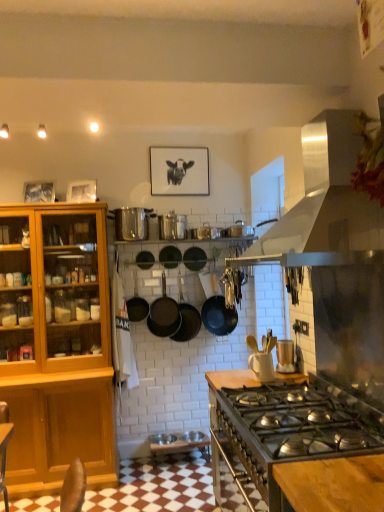
What are the coordinates of `free space above black matte picture frame at upper center (from a real-world perspective)` in the screenshot? It's located at [188, 142].